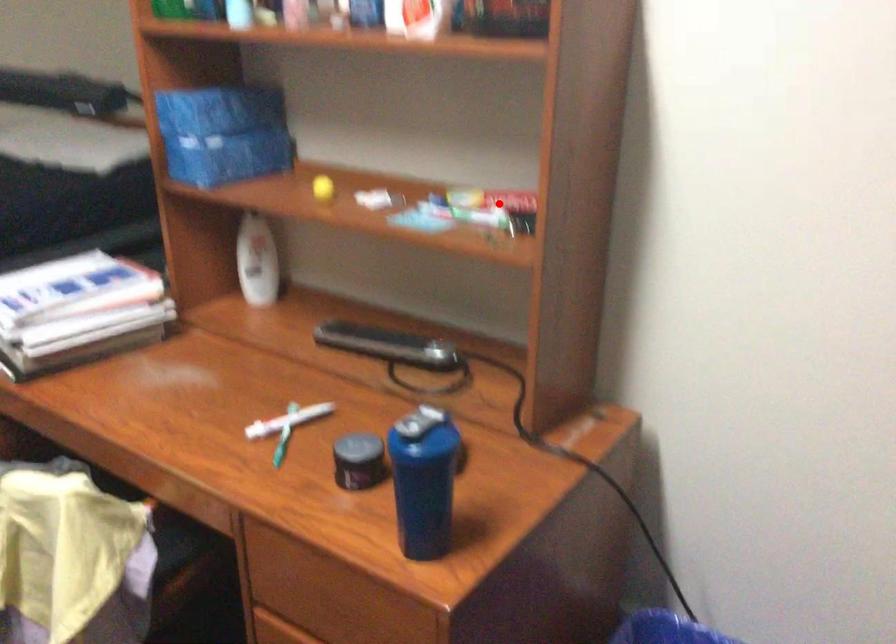
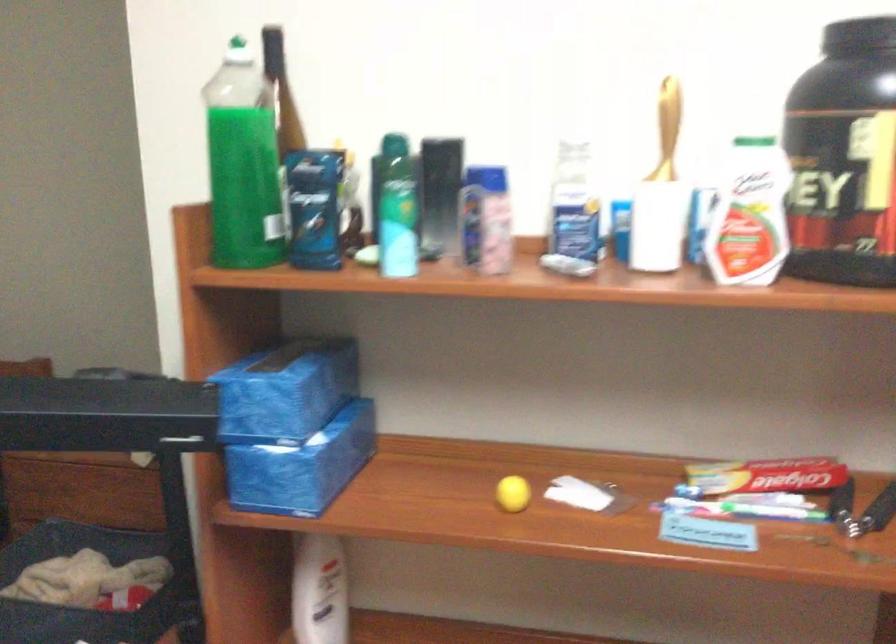
The point at the highlighted location is marked in the first image. Where is the corresponding point in the second image?

(764, 483)